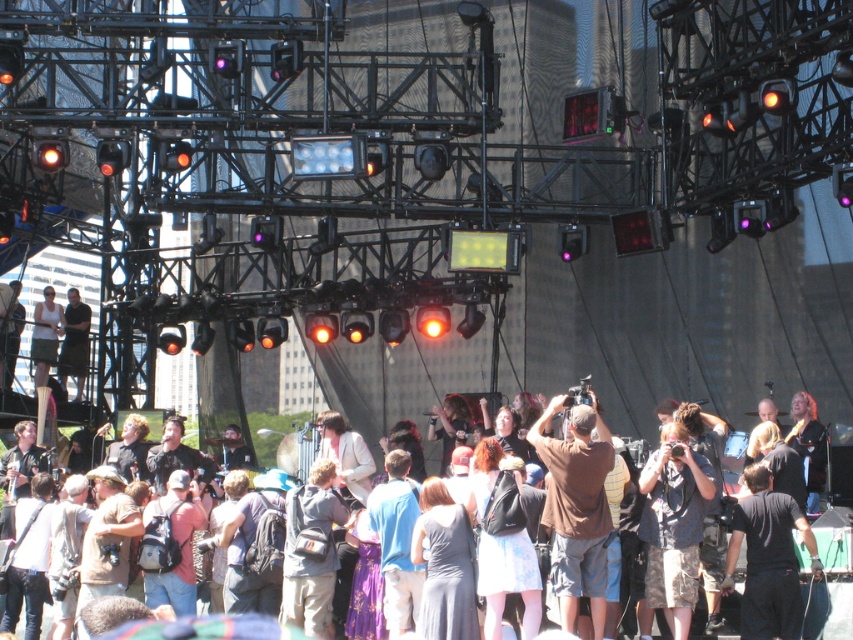
You are a photographer at the concert. You have a matte black camera at center and see someone wearing camo shorts at center. Which object in your viewfinder is larger?

The camo shorts at center is bigger than the matte black camera at center, so the camo shorts at center appears larger in your viewfinder.

You are at the concert and want to take a photo of the stage. The camera you have can focus on objects up to 300 feet away. Is the point at coordinates point (567, 508) within the camera focus range?

The point at coordinates point (567, 508) is 317.63 feet from the camera, which exceeds the camera focus range of 300 feet. Therefore, the camera cannot focus on that point.